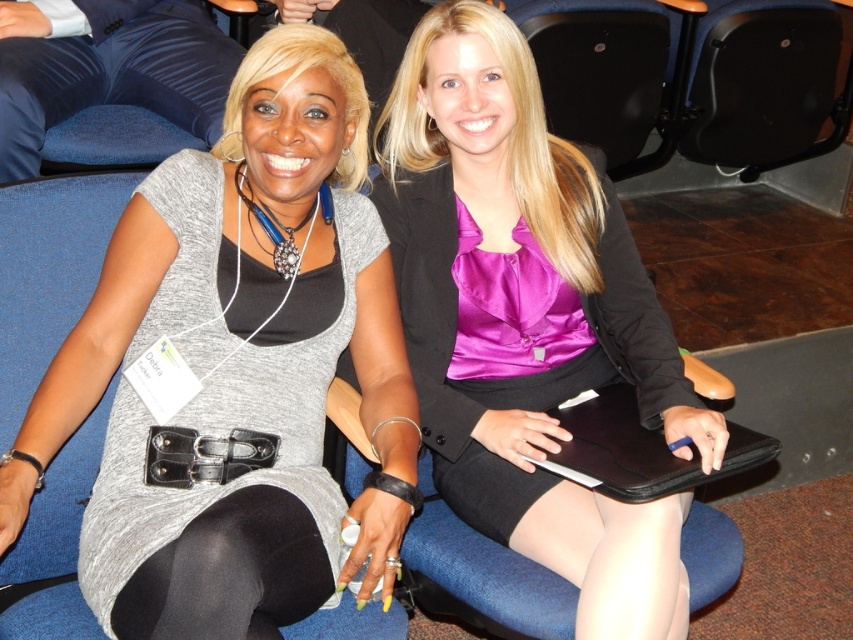
Is matte gray dress at center above purple satin blouse at center?

Yes.

Is point (154, 240) more distant than point (427, 44)?

No, it is in front of (427, 44).

At what (x,y) coordinates should I click in order to perform the action: click on matte gray dress at center. Please return your answer as a coordinate pair (x, y). Looking at the image, I should click on (236, 371).